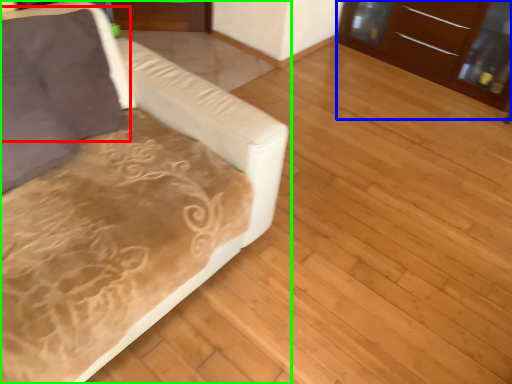
Question: Which is farther away from pillow (highlighted by a red box)? dresser (highlighted by a blue box) or studio couch (highlighted by a green box)?

Choices:
 (A) dresser
 (B) studio couch

Answer: (A)